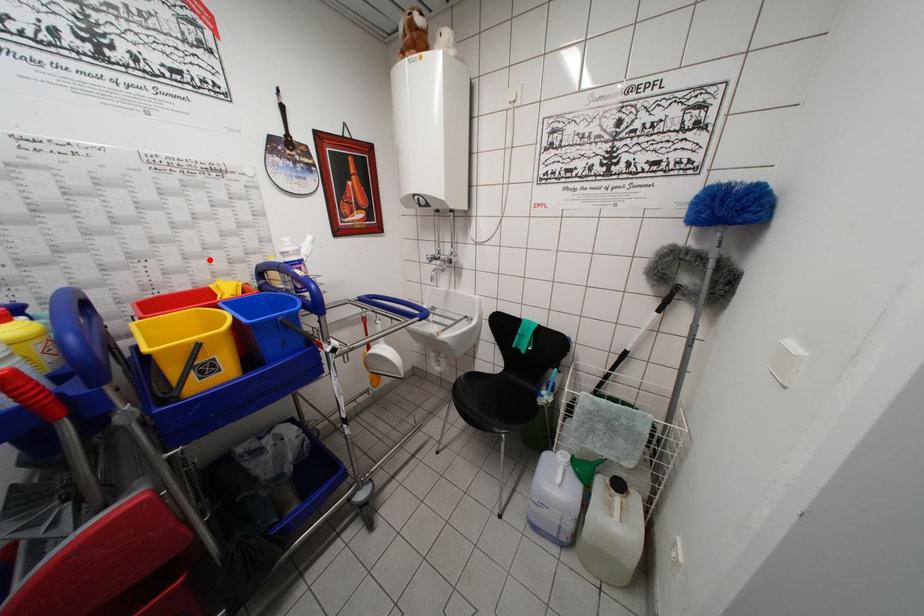
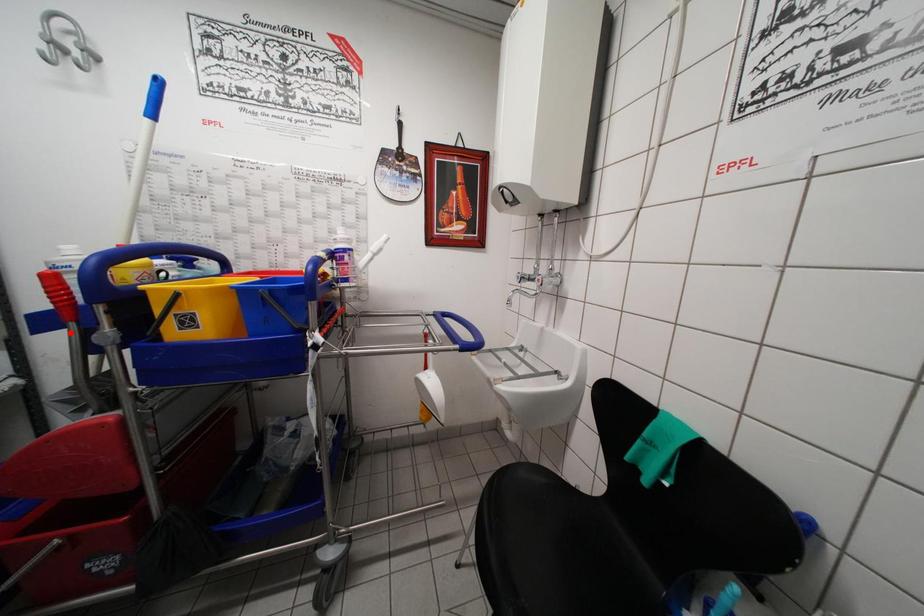
Looking at this image, I am providing you with two images of the same scene from different viewpoints. A red point is marked on the first image and another point is marked on the second image. Is the red point in image1 aligned with the point shown in image2?

No